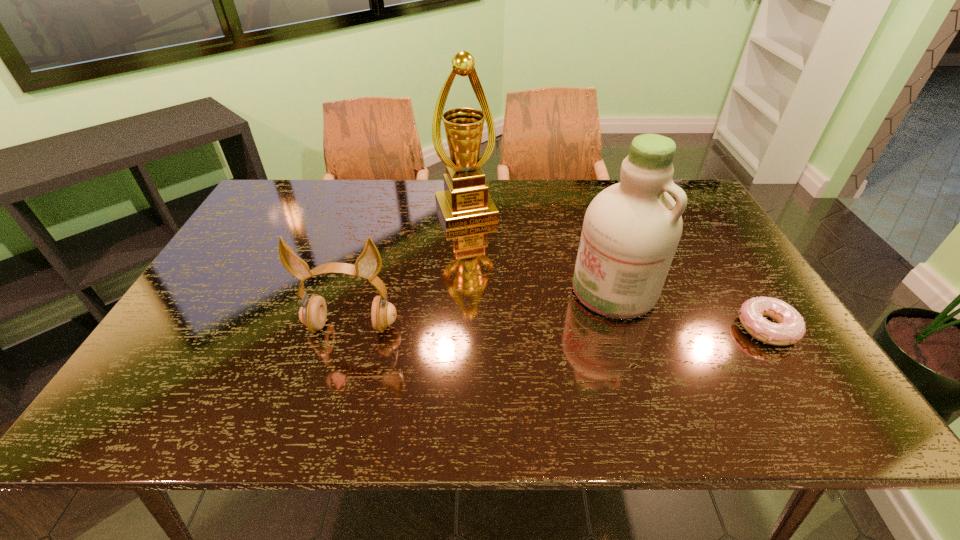
You are a GUI agent. You are given a task and a screenshot of the screen. Output one action in this format:
    pyautogui.click(x=<x>, y=<y>)
    Task: Click on the vacant space that's between the earphone and the doughnut
    
    Given the screenshot: What is the action you would take?
    pyautogui.click(x=559, y=327)

Locate an element on the screen. This screenshot has width=960, height=540. free space between the leftmost object and the award is located at coordinates (409, 269).

Image resolution: width=960 pixels, height=540 pixels. In order to click on free space between the farthest object and the earphone in this screenshot , I will do `click(409, 269)`.

The height and width of the screenshot is (540, 960). Find the location of `free point between the doughnut and the second object from right to left`. free point between the doughnut and the second object from right to left is located at coordinates (690, 309).

You are a GUI agent. You are given a task and a screenshot of the screen. Output one action in this format:
    pyautogui.click(x=<x>, y=<y>)
    Task: Click on the vacant space that's between the earphone and the rightmost object
    Image resolution: width=960 pixels, height=540 pixels.
    Given the screenshot: What is the action you would take?
    pyautogui.click(x=559, y=327)

The image size is (960, 540). I want to click on free space between the second object from left to right and the third tallest object, so click(x=409, y=269).

This screenshot has width=960, height=540. I want to click on the third closest object to the second object from left to right, so click(790, 329).

The image size is (960, 540). Find the location of `object that ranks as the second closest to the third tallest object`. object that ranks as the second closest to the third tallest object is located at coordinates pyautogui.click(x=631, y=230).

Where is `free space that satisfies the following two spatial constraints: 1. on the front-facing side of the shortest object; 2. on the right side of the leftmost object`? Image resolution: width=960 pixels, height=540 pixels. free space that satisfies the following two spatial constraints: 1. on the front-facing side of the shortest object; 2. on the right side of the leftmost object is located at coordinates (351, 328).